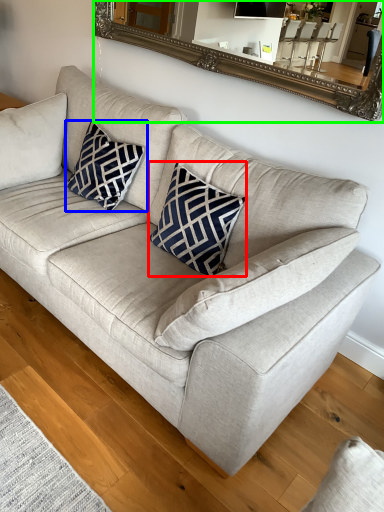
Question: Estimate the real-world distances between objects in this image. Which object is farther from throw pillow (highlighted by a red box), pillow (highlighted by a blue box) or mirror (highlighted by a green box)?

Choices:
 (A) pillow
 (B) mirror

Answer: (B)